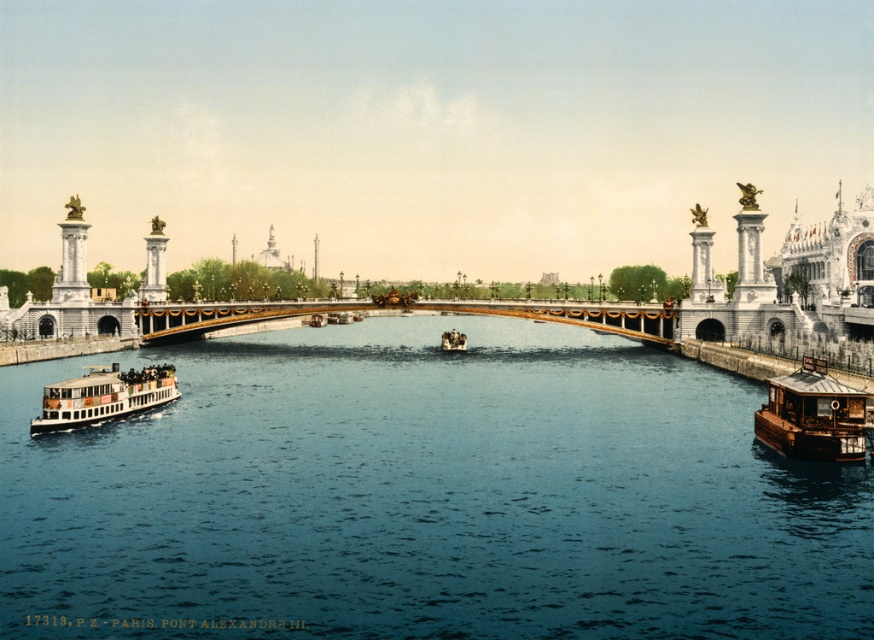
Can you confirm if blue water at center is positioned below wooden cabin boat at lower right?

Indeed, blue water at center is positioned under wooden cabin boat at lower right.

This screenshot has width=874, height=640. Describe the element at coordinates (425, 496) in the screenshot. I see `blue water at center` at that location.

Which is behind, point (458, 608) or point (789, 444)?

Point (789, 444)

I want to click on blue water at center, so click(425, 496).

Locate an element on the screen. Image resolution: width=874 pixels, height=640 pixels. blue water at center is located at coordinates (425, 496).

At what (x,y) coordinates should I click in order to perform the action: click on blue water at center. Please return your answer as a coordinate pair (x, y). The width and height of the screenshot is (874, 640). Looking at the image, I should click on (425, 496).

Is wooden cabin boat at lower right below white polished wood boat at lower left?

Incorrect, wooden cabin boat at lower right is not positioned below white polished wood boat at lower left.

Can you confirm if wooden cabin boat at lower right is smaller than white polished wood boat at lower left?

Yes.

Which is in front, point (800, 384) or point (167, 364)?

Point (800, 384)

Image resolution: width=874 pixels, height=640 pixels. Identify the location of wooden cabin boat at lower right. point(813,416).